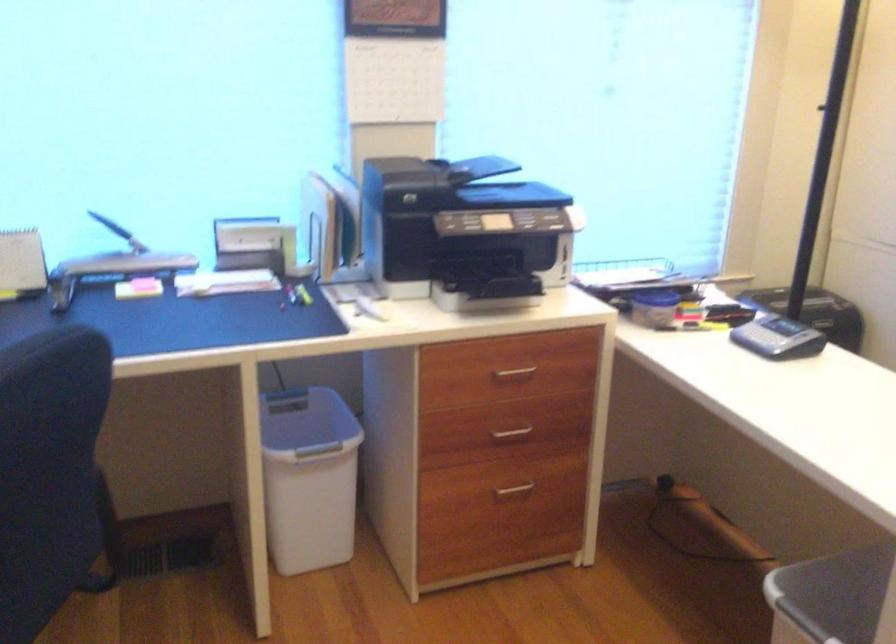
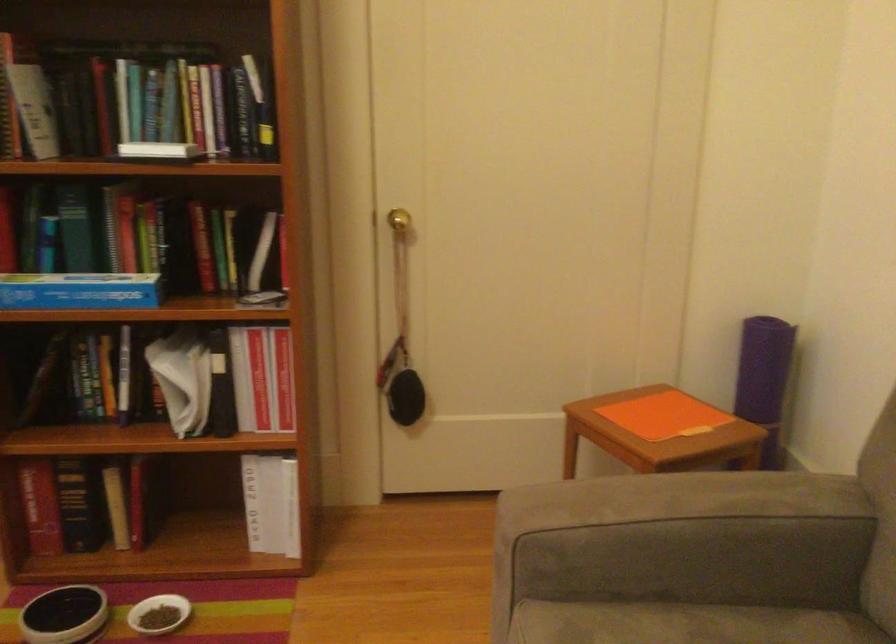
The first image is from the beginning of the video and the second image is from the end. How did the camera likely rotate when shooting the video?

The camera rotated toward right-down.